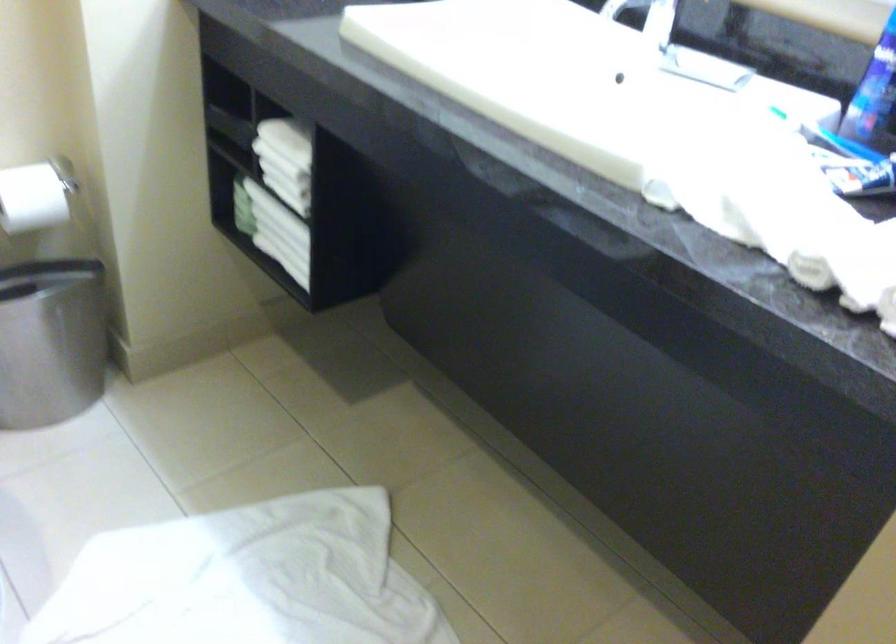
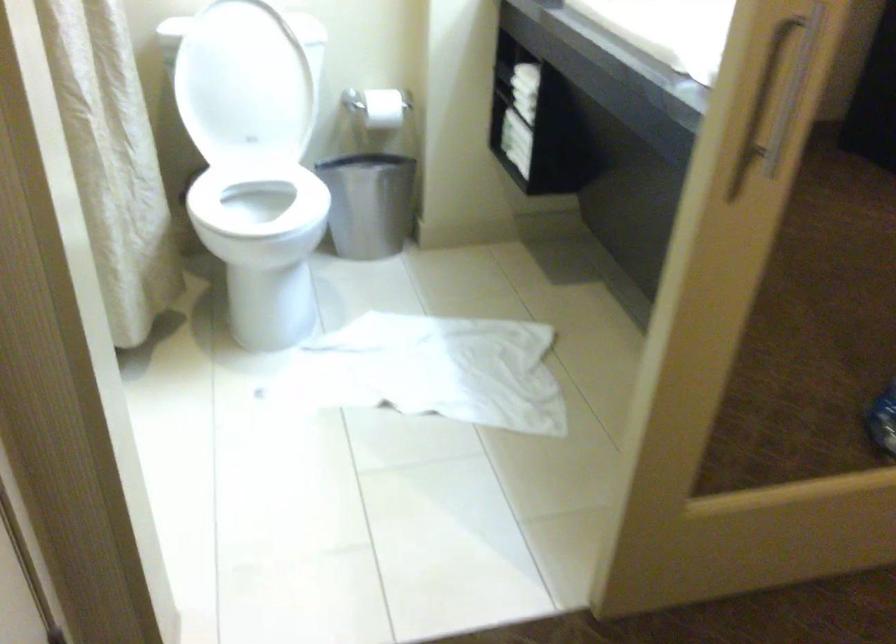
In a continuous first-person perspective shot, in which direction is the camera moving?

The cameraman walked toward right, backward.